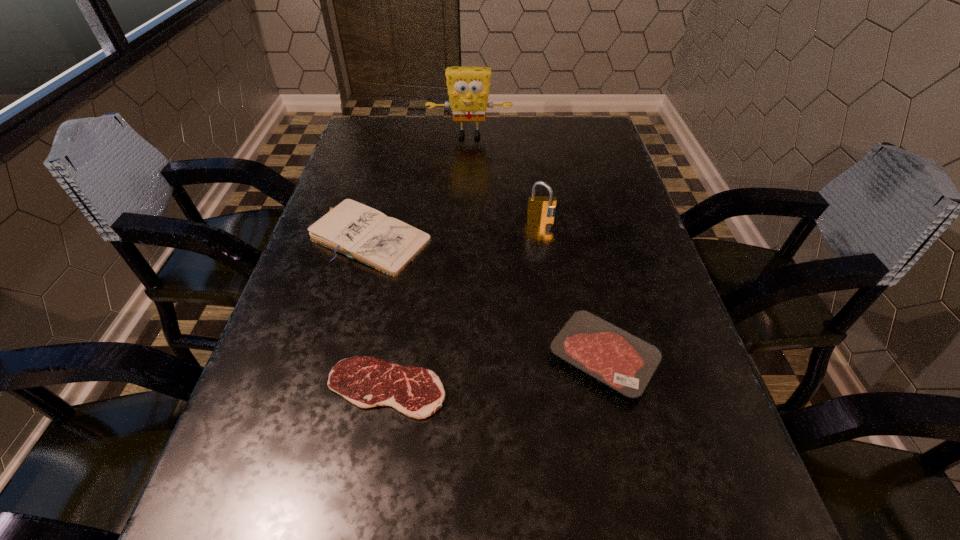
Where is `empty location between the notebook and the shorter steak`? empty location between the notebook and the shorter steak is located at coordinates (379, 313).

What are the coordinates of `free space that is in between the shortest object and the second shortest object` in the screenshot? It's located at (494, 373).

Select which object is the third closest to the left steak. Please provide its 2D coordinates. Your answer should be formatted as a tuple, i.e. [(x, y)], where the tuple contains the x and y coordinates of a point satisfying the conditions above.

[(540, 208)]

Identify which object is the second nearest to the sponge. Please provide its 2D coordinates. Your answer should be formatted as a tuple, i.e. [(x, y)], where the tuple contains the x and y coordinates of a point satisfying the conditions above.

[(540, 208)]

Where is `vacant space that satisfies the following two spatial constraints: 1. on the back side of the shortest object; 2. on the right side of the taller steak`? Image resolution: width=960 pixels, height=540 pixels. vacant space that satisfies the following two spatial constraints: 1. on the back side of the shortest object; 2. on the right side of the taller steak is located at coordinates (392, 358).

You are a GUI agent. You are given a task and a screenshot of the screen. Output one action in this format:
    pyautogui.click(x=<x>, y=<y>)
    Task: Click on the free spot that satisfies the following two spatial constraints: 1. on the face of the sponge; 2. on the right side of the taller steak
    This screenshot has width=960, height=540.
    Given the screenshot: What is the action you would take?
    pyautogui.click(x=462, y=358)